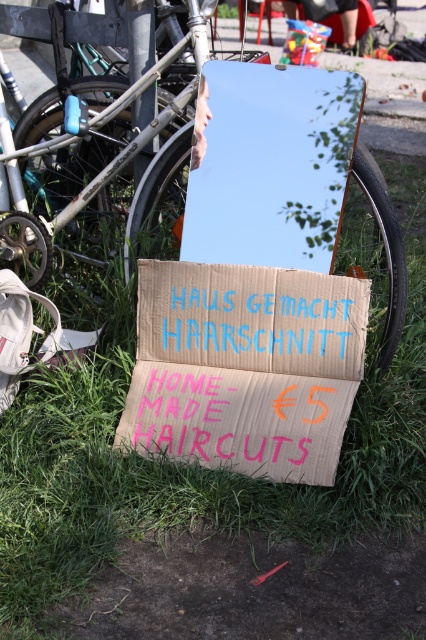
Is silver metallic bicycle at upper left taller than cardboard sign at center?

Yes, silver metallic bicycle at upper left is taller than cardboard sign at center.

What are the coordinates of `silver metallic bicycle at upper left` in the screenshot? It's located at (233, 173).

Find the location of a particular element. This screenshot has height=640, width=426. silver metallic bicycle at upper left is located at coordinates (233, 173).

Describe the element at coordinates (233, 173) in the screenshot. The height and width of the screenshot is (640, 426). I see `silver metallic bicycle at upper left` at that location.

Is point (290, 227) positioned after point (302, 120)?

Yes, it is behind point (302, 120).

Which is in front, point (192, 173) or point (333, 198)?

Point (333, 198)

The width and height of the screenshot is (426, 640). Identify the location of silver metallic bicycle at upper left. (233, 173).

Who is positioned more to the right, cardboard sign at center or metallic reflective mirror at center?

From the viewer's perspective, metallic reflective mirror at center appears more on the right side.

Between cardboard sign at center and metallic reflective mirror at center, which one is positioned higher?

metallic reflective mirror at center

Is point (316, 376) positioned in front of point (310, 141)?

No, it is not.

Where is `cardboard sign at center`? The width and height of the screenshot is (426, 640). cardboard sign at center is located at coordinates [x=245, y=365].